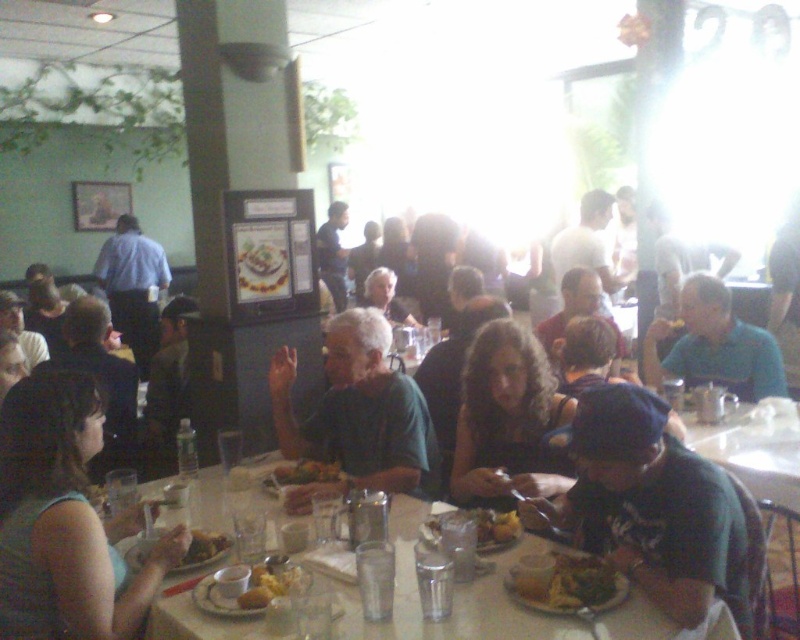
Question: Which point is closer to the camera?

Choices:
 (A) (302, 468)
 (B) (490, 540)
 (C) (145, 544)
 (D) (732, 579)

Answer: (D)

Question: Is matte green tank top at lower left in front of matte green shirt at center?

Choices:
 (A) yes
 (B) no

Answer: (A)

Question: Estimate the real-world distances between objects in this image. Which object is farther from the matte green tank top at lower left?

Choices:
 (A) blue shirt at center
 (B) matte green shirt at center
 (C) yellow matte bread at center
 (D) golden fried chicken at center

Answer: (A)

Question: Is green matte shirt at center above blue shirt at center?

Choices:
 (A) yes
 (B) no

Answer: (B)

Question: Is matte green shirt at center closer to the viewer compared to matte plastic cup at center?

Choices:
 (A) no
 (B) yes

Answer: (A)

Question: Which point is closer to the camera taking this photo?

Choices:
 (A) (476, 580)
 (B) (248, 602)
 (C) (516, 433)
 (D) (566, 593)

Answer: (D)